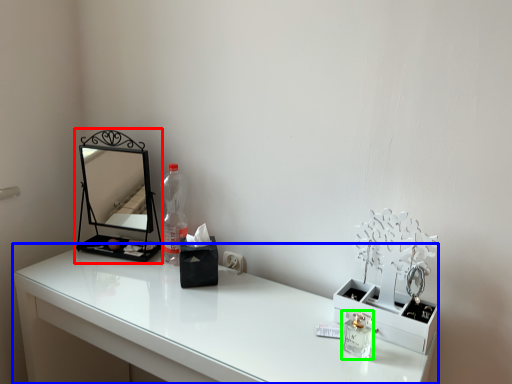
Question: Which object is positioned farthest from medicine cabinet (highlighted by a red box)? Select from table (highlighted by a blue box) and perfume (highlighted by a green box).

Choices:
 (A) table
 (B) perfume

Answer: (B)